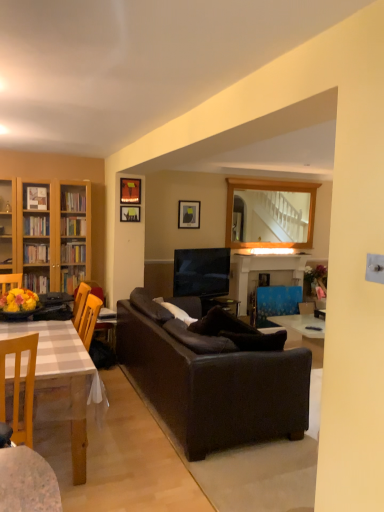
Question: Is blue fabric swivel chair at center to the left of matte black picture frame at upper center, placed as the 3th picture frame when sorted from left to right, from the viewer's perspective?

Choices:
 (A) no
 (B) yes

Answer: (A)

Question: Is blue fabric swivel chair at center smaller than matte black picture frame at upper center, which is the 3th picture frame from front to back?

Choices:
 (A) no
 (B) yes

Answer: (A)

Question: Is blue fabric swivel chair at center looking in the opposite direction of matte black picture frame at upper center, acting as the first picture frame starting from the right?

Choices:
 (A) yes
 (B) no

Answer: (B)

Question: From a real-world perspective, is blue fabric swivel chair at center on matte black picture frame at upper center, which is counted as the first picture frame, starting from the back?

Choices:
 (A) yes
 (B) no

Answer: (B)

Question: Is blue fabric swivel chair at center positioned far away from matte black picture frame at upper center, which is the 3th picture frame from front to back?

Choices:
 (A) yes
 (B) no

Answer: (A)

Question: Considering the positions of matte black picture frame at upper center, positioned as the third picture frame in right-to-left order, and matte black picture frame at upper center, placed as the 3th picture frame when sorted from left to right, in the image, is matte black picture frame at upper center, positioned as the third picture frame in right-to-left order, bigger or smaller than matte black picture frame at upper center, placed as the 3th picture frame when sorted from left to right,?

Choices:
 (A) small
 (B) big

Answer: (A)

Question: From the image's perspective, is matte black picture frame at upper center, which ranks as the second picture frame in back-to-front order, positioned above or below matte black picture frame at upper center, which is the 3th picture frame from front to back?

Choices:
 (A) below
 (B) above

Answer: (A)

Question: From their relative heights in the image, would you say matte black picture frame at upper center, which is the second picture frame from front to back, is taller or shorter than matte black picture frame at upper center, placed as the 3th picture frame when sorted from left to right?

Choices:
 (A) short
 (B) tall

Answer: (A)

Question: From a real-world perspective, is matte black picture frame at upper center, positioned as the third picture frame in right-to-left order, physically located above or below matte black picture frame at upper center, which is counted as the first picture frame, starting from the back?

Choices:
 (A) below
 (B) above

Answer: (A)

Question: Which is correct: matte black picture frame at upper center, which is the 3th picture frame from front to back, is inside matte black picture frame at upper center, which ranks as the second picture frame in back-to-front order, or outside of it?

Choices:
 (A) outside
 (B) inside

Answer: (A)

Question: Considering the positions of matte black picture frame at upper center, placed as the 3th picture frame when sorted from left to right, and matte black picture frame at upper center, positioned as the third picture frame in right-to-left order, in the image, is matte black picture frame at upper center, placed as the 3th picture frame when sorted from left to right, bigger or smaller than matte black picture frame at upper center, positioned as the third picture frame in right-to-left order,?

Choices:
 (A) big
 (B) small

Answer: (A)

Question: Is point (198, 226) positioned closer to the camera than point (119, 221)?

Choices:
 (A) farther
 (B) closer

Answer: (A)

Question: Based on their positions, is matte black picture frame at upper center, acting as the first picture frame starting from the right, located to the left or right of matte black picture frame at upper center, positioned as the third picture frame in right-to-left order?

Choices:
 (A) left
 (B) right

Answer: (B)

Question: Considering their positions, is white checkered table at left located in front of or behind wooden chair at lower left?

Choices:
 (A) behind
 (B) front

Answer: (A)

Question: From a real-world perspective, is white checkered table at left positioned above or below wooden chair at lower left?

Choices:
 (A) above
 (B) below

Answer: (B)